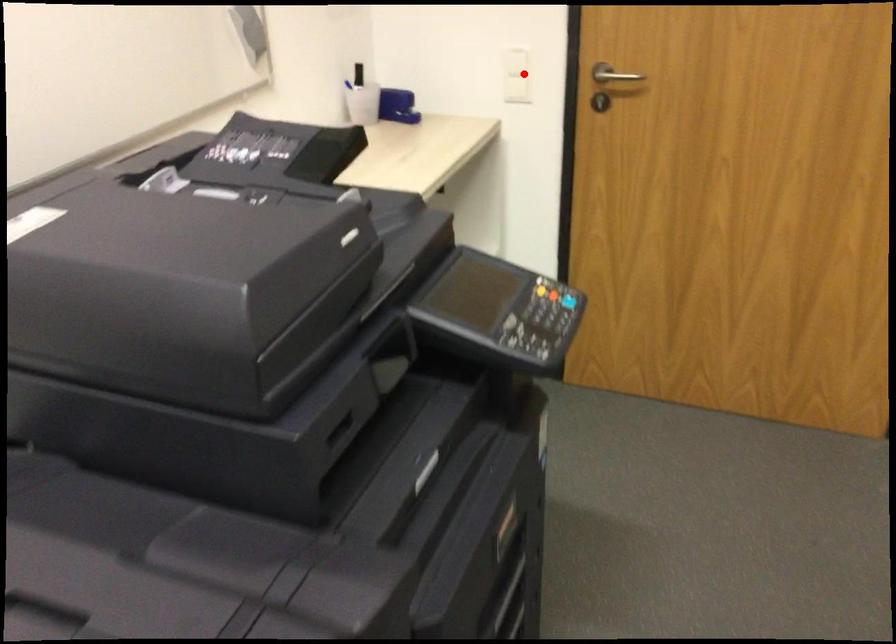
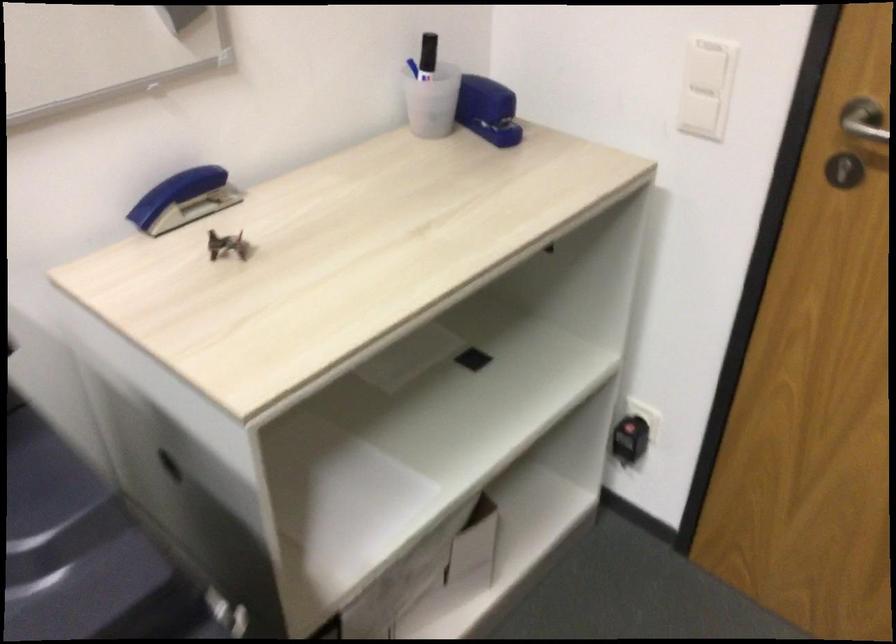
Question: A red point is marked in image1. In image2, is the corresponding 3D point closer to the camera or farther? Reply with the corresponding letter.

Choices:
 (A) The corresponding 3D point is closer.
 (B) The corresponding 3D point is farther.

Answer: (A)